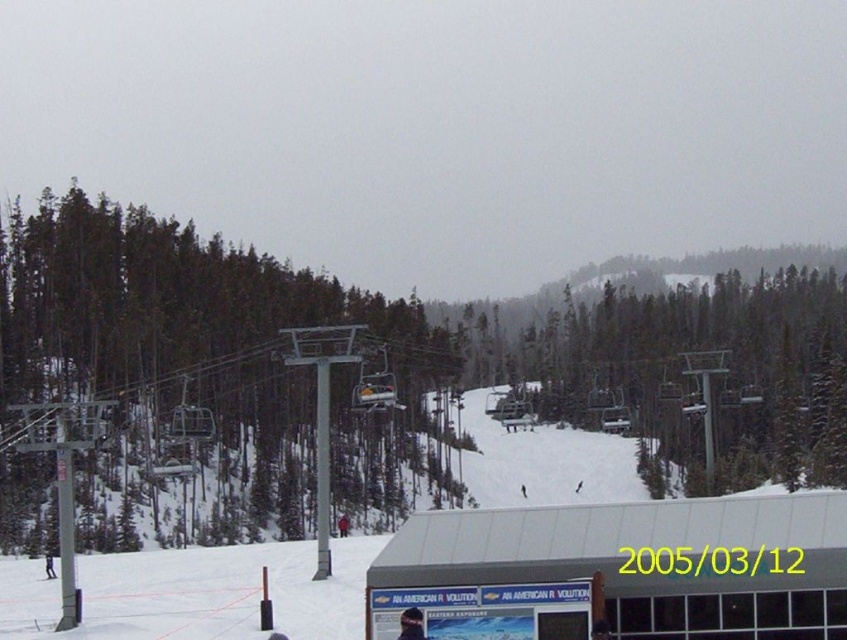
You are standing at the ski lift station and want to locate the green matte tree at left and the white matte building at lower center. From your current position, which object is positioned to the right of the other?

The green matte tree at left is to the right of the white matte building at lower center.

You are a skier standing at the base of the slope near the white plastic ski at lower left. You want to reach the ski lift station sign that says AN AMERICAN REVOLUTION. Which direction should you move relative to the green matte tree at left?

You should move to the left of the green matte tree at left because the white plastic ski at lower left is positioned to the right of the green matte tree at left, so moving left from the ski would head towards the station sign.